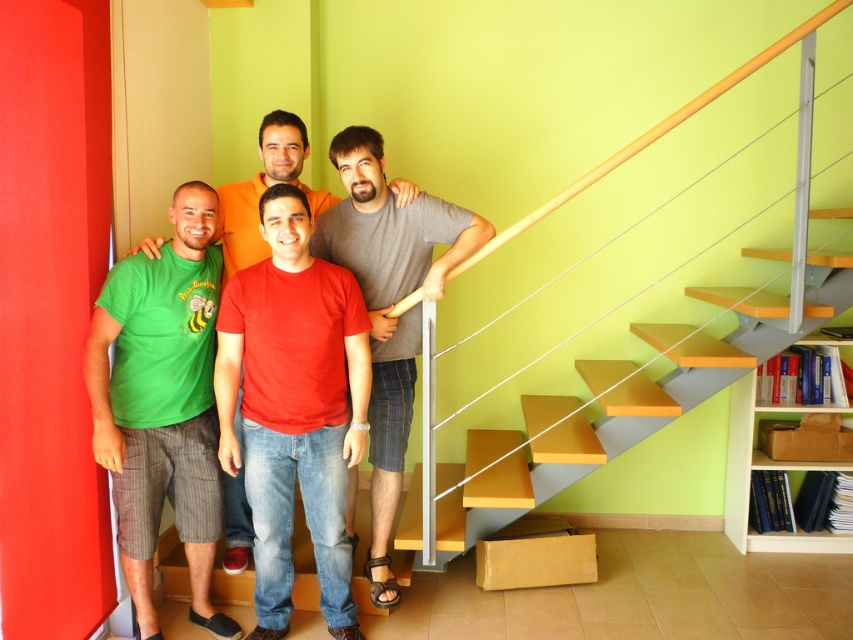
Question: Which object is positioned farthest from the white wooden bookshelf at right?

Choices:
 (A) gray cotton t-shirt at center
 (B) matte red t-shirt at center
 (C) green matte t-shirt at left

Answer: (C)

Question: Which object is positioned farthest from the white wooden bookshelf at right?

Choices:
 (A) red matte t-shirt at center
 (B) green matte t-shirt at left

Answer: (B)

Question: Can you confirm if green matte t-shirt at left is wider than wooden at right?

Choices:
 (A) yes
 (B) no

Answer: (B)

Question: Does green matte t-shirt at left appear over white wooden bookshelf at right?

Choices:
 (A) no
 (B) yes

Answer: (B)

Question: Can you confirm if wooden at right is positioned to the right of white wooden bookshelf at right?

Choices:
 (A) yes
 (B) no

Answer: (B)

Question: Among these points, which one is nearest to the camera?

Choices:
 (A) (299, 316)
 (B) (380, 349)
 (C) (682, 403)

Answer: (A)